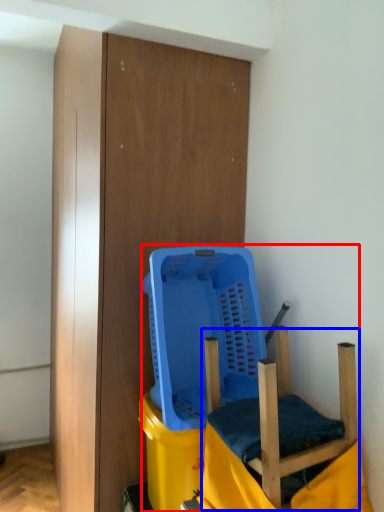
Question: Which of the following is the closest to the observer, furniture (highlighted by a red box) or swivel chair (highlighted by a blue box)?

Choices:
 (A) furniture
 (B) swivel chair

Answer: (B)